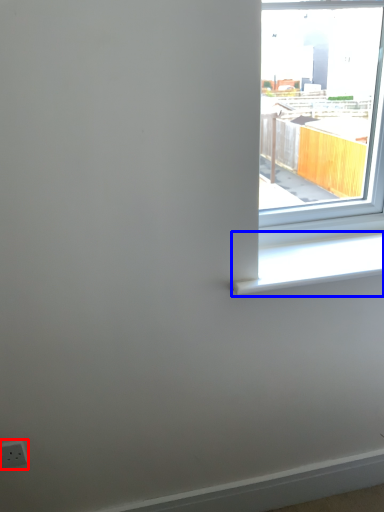
Question: Which of the following is the closest to the observer, electric outlet (highlighted by a red box) or window sill (highlighted by a blue box)?

Choices:
 (A) electric outlet
 (B) window sill

Answer: (B)